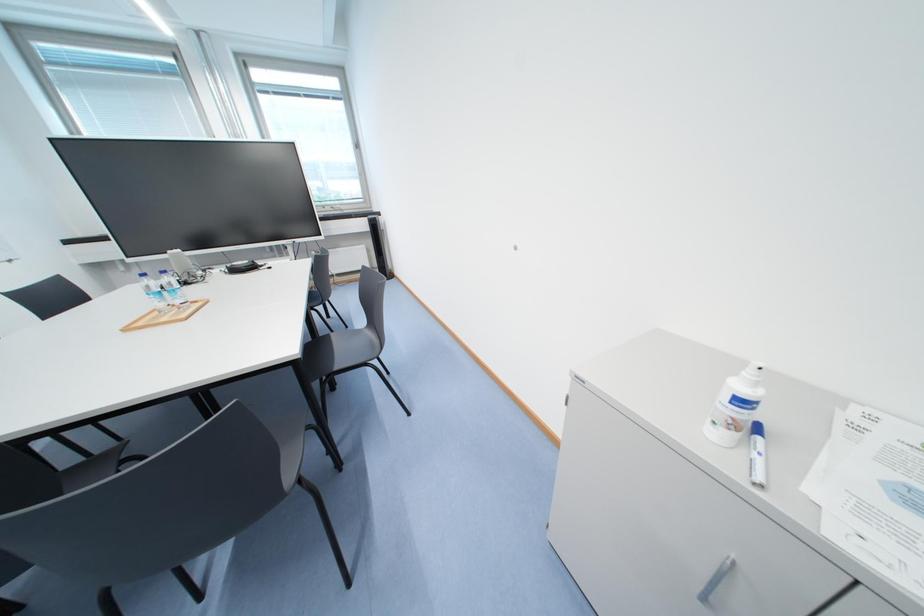
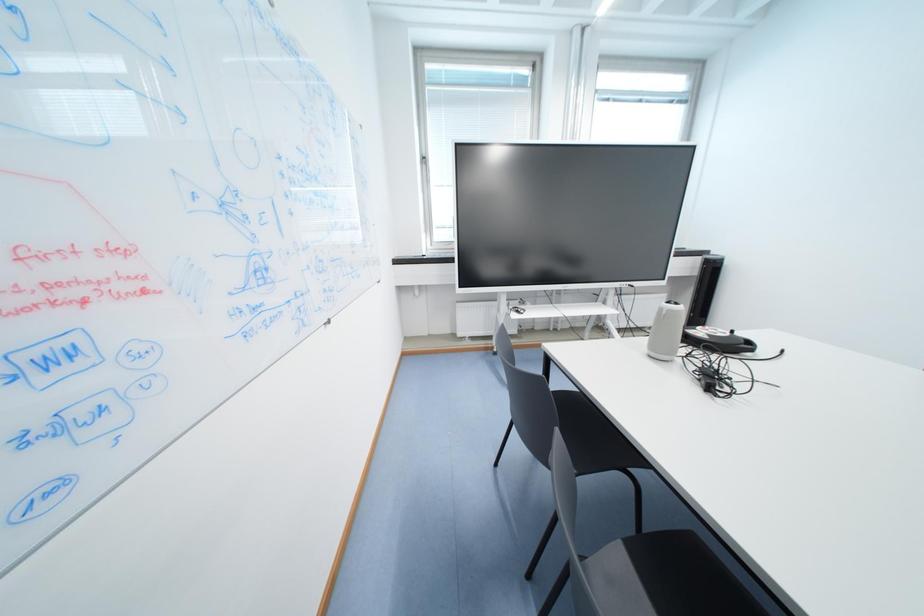
Question: What movement of the cameraman would produce the second image?

Choices:
 (A) Left
 (B) Right
 (C) Forward
 (D) Backward

Answer: (A)